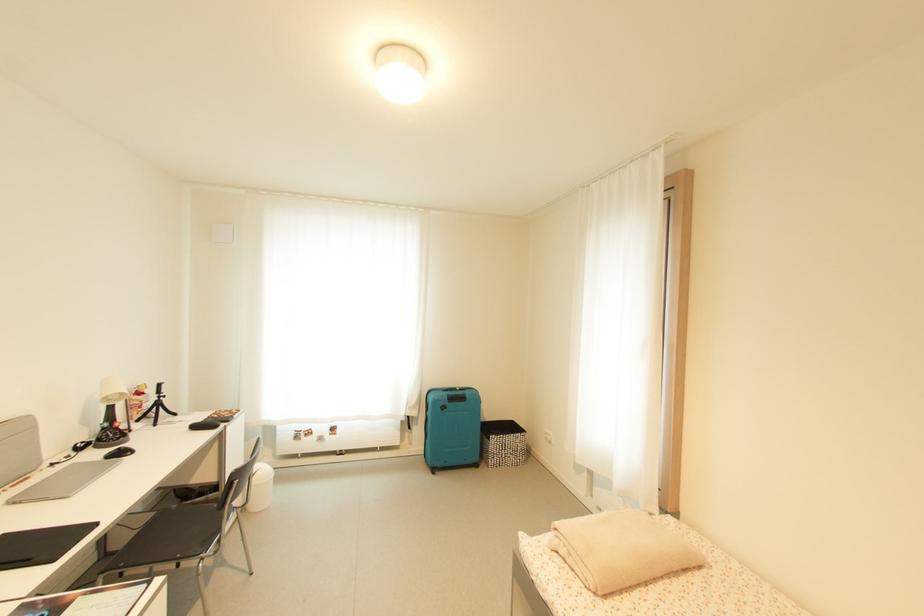
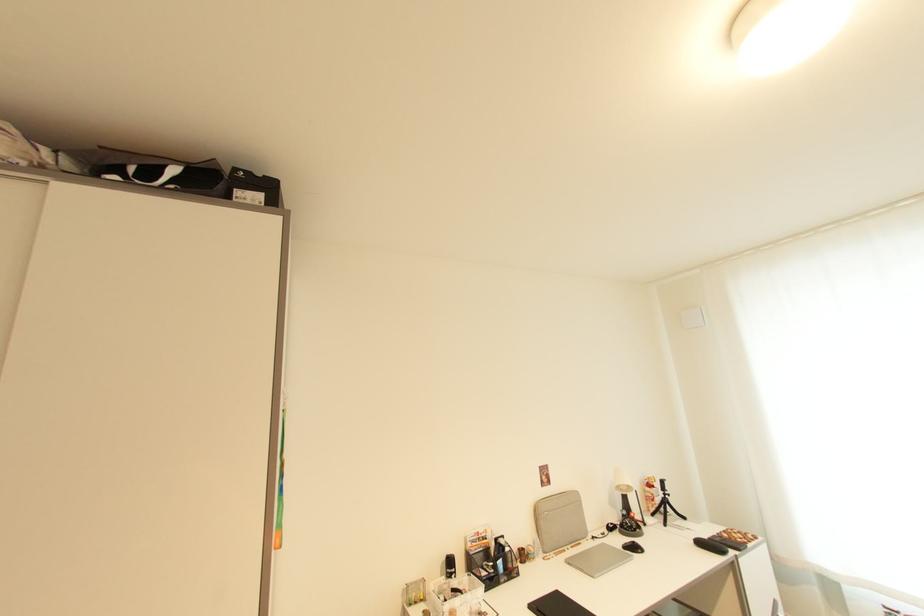
The images are taken continuously from a first-person perspective. In which direction is your viewpoint rotating?

The rotation direction of the camera is left-up.